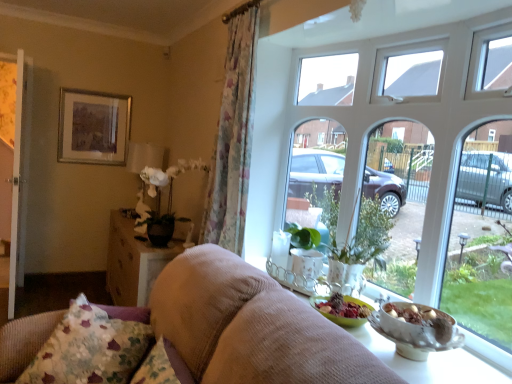
Question: Is floral fabric curtain at left bigger or smaller than white glass window at upper center?

Choices:
 (A) small
 (B) big

Answer: (A)

Question: Is floral fabric curtain at left taller or shorter than white glass window at upper center?

Choices:
 (A) short
 (B) tall

Answer: (B)

Question: Which object is the farthest from the suede-like beige sofa at center?

Choices:
 (A) white matte floral arrangement at center-left
 (B) white glass window at upper center
 (C) wooden textured table at lower left
 (D) floral fabric curtain at left
 (E) fluffy fabric pillow at lower left

Answer: (A)

Question: Considering the real-world distances, which object is closest to the green glossy houseplant at center?

Choices:
 (A) fluffy fabric pillow at lower left
 (B) silver metallic picture frame at upper left
 (C) floral fabric curtain at left
 (D) white wooden screen door at left
 (E) suede-like beige sofa at center

Answer: (C)